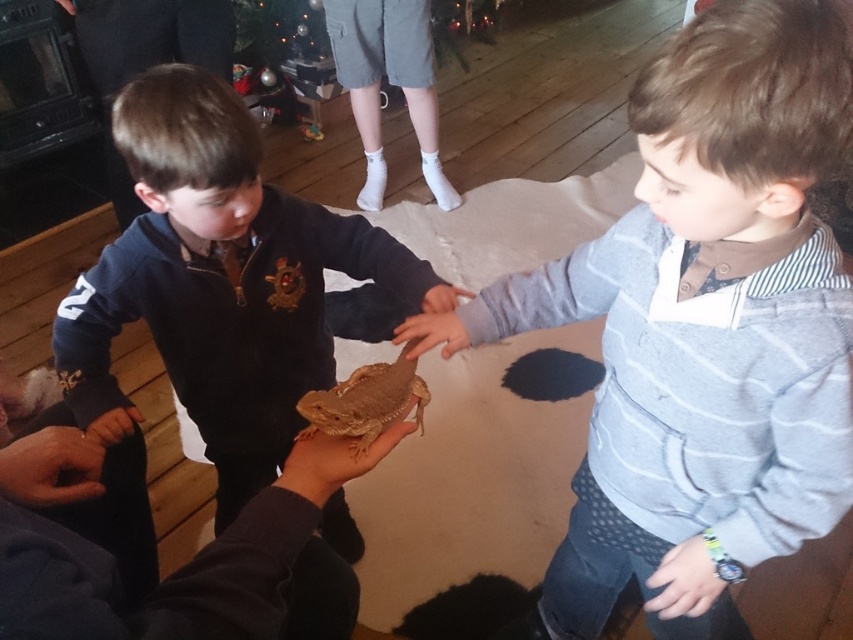
Question: Is matte brown sweater at center below smooth brown hand at center?

Choices:
 (A) no
 (B) yes

Answer: (B)

Question: Which of the following is the farthest from the observer?

Choices:
 (A) matte brown sweater at center
 (B) brown scaly lizard at center
 (C) smooth brown hand at center

Answer: (B)

Question: Does matte brown sweater at center have a lesser width compared to smooth brown hand at center?

Choices:
 (A) yes
 (B) no

Answer: (B)

Question: Does matte brown sweater at center appear under smooth brown hand at center?

Choices:
 (A) no
 (B) yes

Answer: (B)

Question: Which object is farther from the camera taking this photo?

Choices:
 (A) matte brown sweater at center
 (B) smooth brown hand at center
 (C) brown scaly lizard at center

Answer: (C)

Question: Estimate the real-world distances between objects in this image. Which object is closer to the brown scaly lizard at center?

Choices:
 (A) smooth brown hand at center
 (B) matte brown sweater at center

Answer: (A)